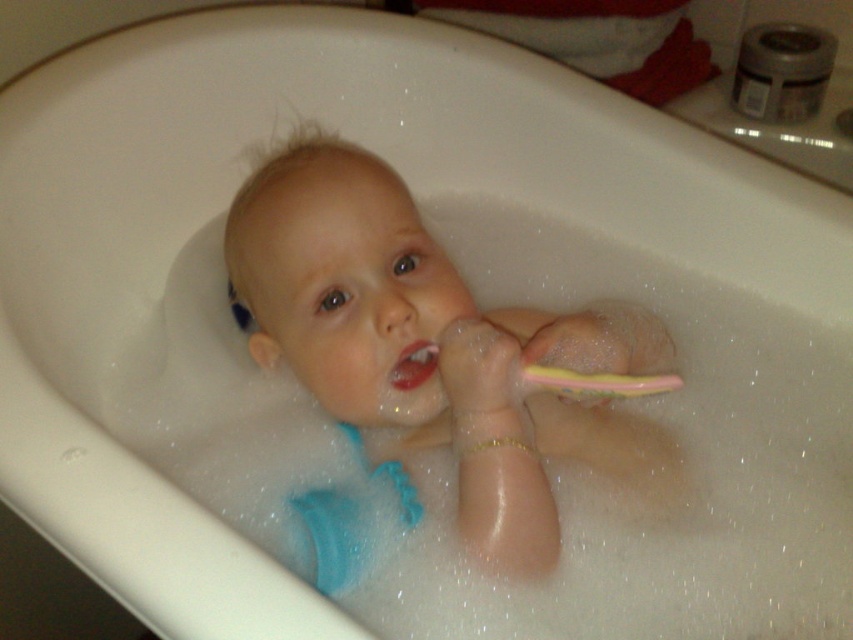
Question: Does smooth plastic toothbrush at center appear under pink rubber toothbrush at upper center?

Choices:
 (A) yes
 (B) no

Answer: (A)

Question: Which point is closer to the camera taking this photo?

Choices:
 (A) (415, 369)
 (B) (529, 342)

Answer: (B)

Question: Considering the real-world distances, which object is closest to the yellow rubber toothbrush at upper center?

Choices:
 (A) pink rubber toothbrush at upper center
 (B) smooth plastic toothbrush at center

Answer: (A)

Question: Can you confirm if yellow rubber toothbrush at upper center is smaller than pink rubber toothbrush at upper center?

Choices:
 (A) no
 (B) yes

Answer: (A)

Question: Is yellow rubber toothbrush at upper center thinner than pink rubber toothbrush at upper center?

Choices:
 (A) no
 (B) yes

Answer: (A)

Question: Based on their relative distances, which object is nearer to the pink rubber toothbrush at upper center?

Choices:
 (A) yellow rubber toothbrush at upper center
 (B) smooth plastic toothbrush at center

Answer: (A)